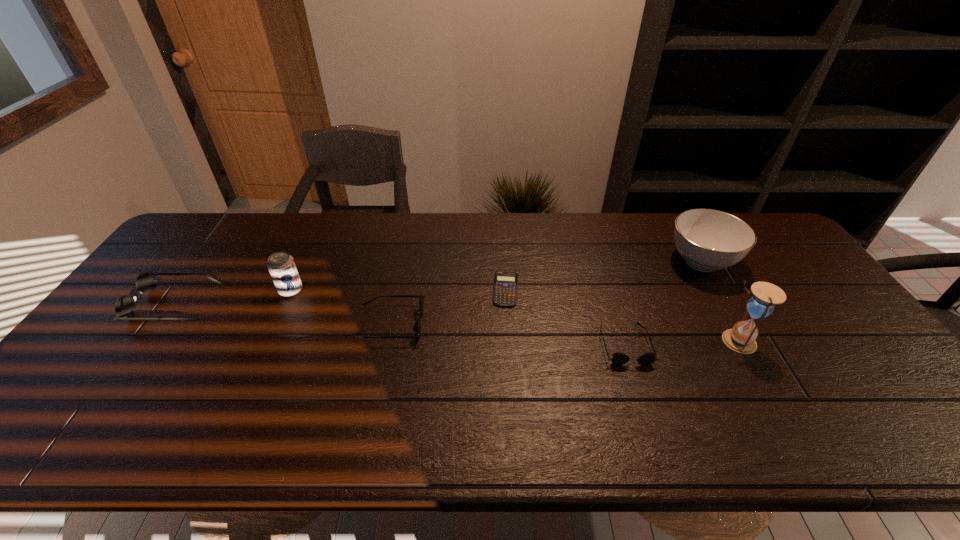
At what (x,y) coordinates should I click in order to perform the action: click on free space at the near edge of the desktop. Please return your answer as a coordinate pair (x, y). The height and width of the screenshot is (540, 960). Looking at the image, I should click on (420, 386).

The image size is (960, 540). I want to click on vacant region at the left edge, so click(139, 298).

The width and height of the screenshot is (960, 540). Find the location of `blank space at the far left corner of the desktop`. blank space at the far left corner of the desktop is located at coordinates (242, 219).

The width and height of the screenshot is (960, 540). What are the coordinates of `free space between the second sunglasses from left to right and the sixth object from right to left` in the screenshot? It's located at (341, 307).

In order to click on vacant space that is in between the leftmost object and the beer can in this screenshot , I will do `click(233, 297)`.

Where is `empty location between the leftmost sunglasses and the chinaware`? empty location between the leftmost sunglasses and the chinaware is located at coordinates (439, 282).

This screenshot has width=960, height=540. I want to click on free space between the beer can and the calculator, so [398, 290].

The height and width of the screenshot is (540, 960). What are the coordinates of `vacant point located between the fourth object from left to right and the tallest sunglasses` in the screenshot? It's located at (341, 296).

Find the location of a particular element. free area in between the leftmost sunglasses and the shortest sunglasses is located at coordinates (400, 324).

This screenshot has width=960, height=540. Identify the location of free spot between the rightmost sunglasses and the hourglass. (681, 343).